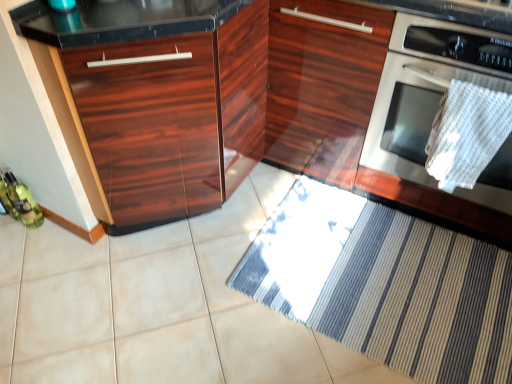
Locate an element on the screen. The height and width of the screenshot is (384, 512). vacant space underneath striped fabric doormat at lower center (from a real-world perspective) is located at coordinates pos(392,291).